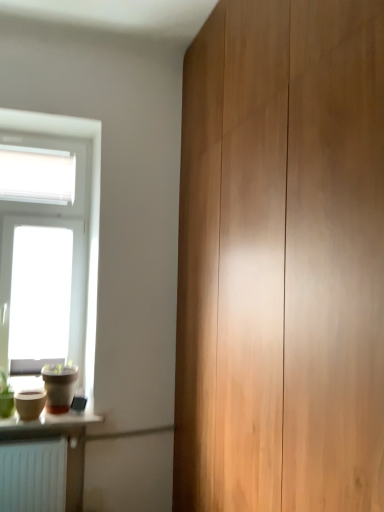
What do you see at coordinates (59, 387) in the screenshot? This screenshot has height=512, width=384. I see `matte brown flowerpot at lower left` at bounding box center [59, 387].

The image size is (384, 512). I want to click on matte brown flowerpot at lower left, so click(59, 387).

What is the approximate width of matte brown flowerpot at lower left?

matte brown flowerpot at lower left is 8.92 inches wide.

Measure the distance between point [71,376] and camera.

A distance of 8.72 feet exists between point [71,376] and camera.

The image size is (384, 512). Find the location of `matte brown flowerpot at lower left`. matte brown flowerpot at lower left is located at coordinates (59, 387).